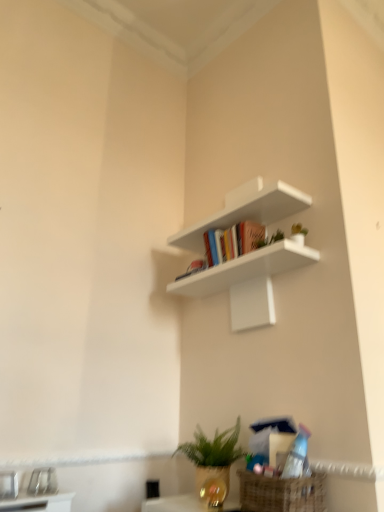
Question: From a real-world perspective, is matte plastic book at center below white matte shelf at upper center?

Choices:
 (A) no
 (B) yes

Answer: (B)

Question: Considering the relative sizes of matte plastic book at center and white matte shelf at upper center in the image provided, is matte plastic book at center wider than white matte shelf at upper center?

Choices:
 (A) yes
 (B) no

Answer: (B)

Question: Is there a large distance between matte plastic book at center and white matte shelf at upper center?

Choices:
 (A) yes
 (B) no

Answer: (B)

Question: Can you confirm if matte plastic book at center is positioned to the left of white matte shelf at upper center?

Choices:
 (A) no
 (B) yes

Answer: (A)

Question: From a real-world perspective, is matte plastic book at center on top of white matte shelf at upper center?

Choices:
 (A) yes
 (B) no

Answer: (B)

Question: Considering the positions of point (201, 499) and point (274, 432), is point (201, 499) closer or farther from the camera than point (274, 432)?

Choices:
 (A) farther
 (B) closer

Answer: (A)

Question: Considering the positions of green matte plant at lower center and matte plastic book at center in the image, is green matte plant at lower center taller or shorter than matte plastic book at center?

Choices:
 (A) short
 (B) tall

Answer: (B)

Question: Which is correct: green matte plant at lower center is inside matte plastic book at center, or outside of it?

Choices:
 (A) inside
 (B) outside

Answer: (B)

Question: Is green matte plant at lower center in front of or behind matte plastic book at center in the image?

Choices:
 (A) front
 (B) behind

Answer: (B)

Question: In terms of height, does white matte shelf at upper center look taller or shorter compared to green matte plant at lower center?

Choices:
 (A) short
 (B) tall

Answer: (B)

Question: In the image, is white matte shelf at upper center on the left side or the right side of green matte plant at lower center?

Choices:
 (A) left
 (B) right

Answer: (B)

Question: Considering the positions of point (294, 204) and point (208, 446), is point (294, 204) closer or farther from the camera than point (208, 446)?

Choices:
 (A) closer
 (B) farther

Answer: (B)

Question: From the image's perspective, is white matte shelf at upper center positioned above or below green matte plant at lower center?

Choices:
 (A) below
 (B) above

Answer: (B)

Question: Is matte plastic book at center bigger or smaller than white matte shelf at upper center?

Choices:
 (A) big
 (B) small

Answer: (B)

Question: Considering the positions of matte plastic book at center and white matte shelf at upper center in the image, is matte plastic book at center wider or thinner than white matte shelf at upper center?

Choices:
 (A) thin
 (B) wide

Answer: (A)